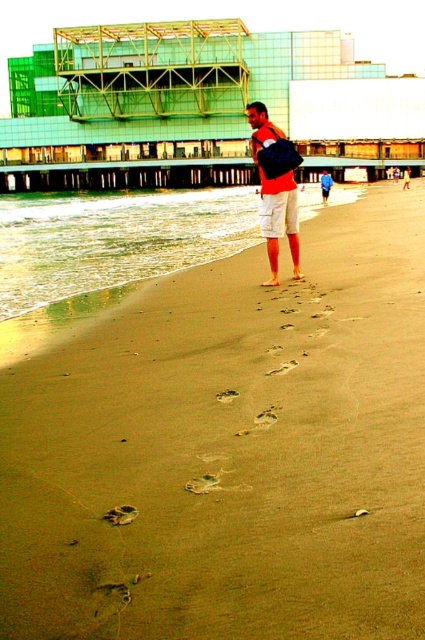
Which is more to the right, matte orange shirt at center or white cotton shorts at center?

From the viewer's perspective, white cotton shorts at center appears more on the right side.

Is matte orange shirt at center thinner than white cotton shorts at center?

No, matte orange shirt at center is not thinner than white cotton shorts at center.

Is point (283, 189) farther from viewer compared to point (261, 200)?

That is False.

In order to click on matte orange shirt at center in this screenshot , I will do `click(275, 188)`.

Which is above, brown sandy beach at center or matte orange shorts at center?

matte orange shorts at center

Consider the image. Who is more distant from viewer, (385,518) or (326,173)?

The point (326,173) is more distant.

Where is `brown sandy beach at center`? brown sandy beach at center is located at coordinates (229, 451).

Can you confirm if brown sandy beach at center is positioned above matte orange shirt at center?

Incorrect, brown sandy beach at center is not positioned above matte orange shirt at center.

Measure the distance between point (295, 417) and camera.

Point (295, 417) and camera are 11.87 feet apart from each other.

Does point (331, 269) come in front of point (269, 256)?

No, (331, 269) is behind (269, 256).

Find the location of a particular element. brown sandy beach at center is located at coordinates (229, 451).